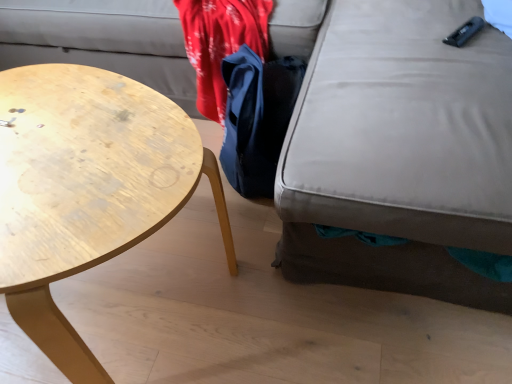
At what (x,y) coordinates should I click in order to perform the action: click on wooden coffee table at left. Please return your answer as a coordinate pair (x, y). This screenshot has height=384, width=512. Looking at the image, I should click on (86, 188).

Identify the location of matte gray swivel chair at lower right. (400, 152).

Is matte gray swivel chair at lower right positioned in front of blue fabric bag at center?

Yes, it is.

Is matte gray swivel chair at lower right located outside blue fabric bag at center?

That's correct, matte gray swivel chair at lower right is outside of blue fabric bag at center.

Is matte gray swivel chair at lower right smaller than blue fabric bag at center?

No.

Considering the positions of objects matte gray swivel chair at lower right and blue fabric bag at center in the image provided, who is more to the left, matte gray swivel chair at lower right or blue fabric bag at center?

Positioned to the left is blue fabric bag at center.

Is matte gray swivel chair at lower right taller or shorter than wooden coffee table at left?

Considering their sizes, matte gray swivel chair at lower right has more height than wooden coffee table at left.

Measure the distance between matte gray swivel chair at lower right and wooden coffee table at left.

matte gray swivel chair at lower right is 43.80 centimeters away from wooden coffee table at left.

Is matte gray swivel chair at lower right oriented away from wooden coffee table at left?

matte gray swivel chair at lower right does not have its back to wooden coffee table at left.

Which is further, (393, 232) or (49, 233)?

The point (393, 232) is farther from the camera.

From a real-world perspective, which is physically above, wooden coffee table at left or blue fabric bag at center?

From a 3D spatial view, wooden coffee table at left is above.

Is wooden coffee table at left far from blue fabric bag at center?

No, wooden coffee table at left is not far from blue fabric bag at center.

Is wooden coffee table at left facing towards blue fabric bag at center?

No, wooden coffee table at left is not turned towards blue fabric bag at center.

Is wooden coffee table at left not within blue fabric bag at center?

Indeed, wooden coffee table at left is completely outside blue fabric bag at center.

Consider the image. Which is behind, wooden coffee table at left or matte gray swivel chair at lower right?

wooden coffee table at left is further away from the camera.

In the scene shown: Measure the distance from wooden coffee table at left to matte gray swivel chair at lower right.

A distance of 17.24 inches exists between wooden coffee table at left and matte gray swivel chair at lower right.

Where is `swivel chair above the wooden coffee table at left (from the image's perspective)`? The image size is (512, 384). swivel chair above the wooden coffee table at left (from the image's perspective) is located at coordinates (400, 152).

From the image's perspective, which one is positioned lower, wooden coffee table at left or matte gray swivel chair at lower right?

wooden coffee table at left appears lower in the image.

Can you confirm if blue fabric bag at center is shorter than matte gray swivel chair at lower right?

Yes, blue fabric bag at center is shorter than matte gray swivel chair at lower right.

Is blue fabric bag at center at the right side of matte gray swivel chair at lower right?

No, blue fabric bag at center is not to the right of matte gray swivel chair at lower right.

Considering their positions, is blue fabric bag at center located in front of or behind matte gray swivel chair at lower right?

Visually, blue fabric bag at center is located behind matte gray swivel chair at lower right.

Which object is wider, blue fabric bag at center or wooden coffee table at left?

Wider between the two is wooden coffee table at left.

From a real-world perspective, is blue fabric bag at center on top of wooden coffee table at left?

No.

The height and width of the screenshot is (384, 512). What are the coordinates of `cloak below the wooden coffee table at left (from a real-world perspective)` in the screenshot? It's located at (257, 118).

Considering their positions, is blue fabric bag at center located in front of or behind wooden coffee table at left?

Clearly, blue fabric bag at center is behind wooden coffee table at left.

Identify the location of swivel chair on the right of blue fabric bag at center. (400, 152).

Where is `swivel chair in front of the wooden coffee table at left`? swivel chair in front of the wooden coffee table at left is located at coordinates (400, 152).

Based on their spatial positions, is matte gray swivel chair at lower right or blue fabric bag at center further from wooden coffee table at left?

Based on the image, matte gray swivel chair at lower right appears to be further to wooden coffee table at left.

Looking at this image, based on their spatial positions, is blue fabric bag at center or matte gray swivel chair at lower right closer to wooden coffee table at left?

The object closer to wooden coffee table at left is blue fabric bag at center.

Estimate the real-world distances between objects in this image. Which object is further from matte gray swivel chair at lower right, blue fabric bag at center or wooden coffee table at left?

wooden coffee table at left is further to matte gray swivel chair at lower right.

Estimate the real-world distances between objects in this image. Which object is closer to matte gray swivel chair at lower right, wooden coffee table at left or blue fabric bag at center?

blue fabric bag at center.

Looking at this image, when comparing their distances from blue fabric bag at center, does wooden coffee table at left or matte gray swivel chair at lower right seem further?

Based on the image, wooden coffee table at left appears to be further to blue fabric bag at center.

Based on the photo, which object lies nearer to the anchor point blue fabric bag at center, matte gray swivel chair at lower right or wooden coffee table at left?

matte gray swivel chair at lower right is closer to blue fabric bag at center.

Where is `cloak between wooden coffee table at left and matte gray swivel chair at lower right in the horizontal direction`? cloak between wooden coffee table at left and matte gray swivel chair at lower right in the horizontal direction is located at coordinates [x=257, y=118].